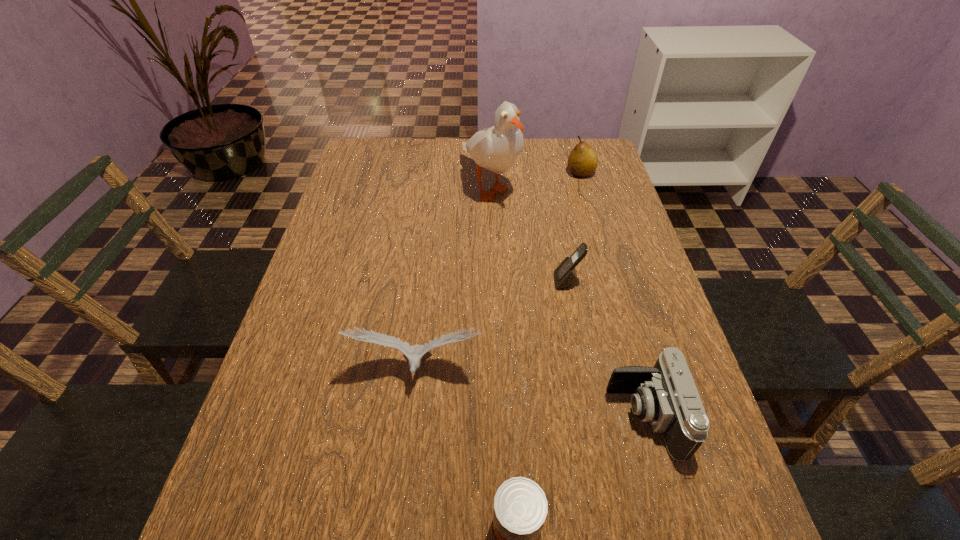
Where is `vacant space located on the front-facing side of the fourth object from left to right`? vacant space located on the front-facing side of the fourth object from left to right is located at coordinates (522, 281).

This screenshot has width=960, height=540. Find the location of `vacant space situated 0.050m on the front-facing side of the fourth object from left to right`. vacant space situated 0.050m on the front-facing side of the fourth object from left to right is located at coordinates (535, 281).

The image size is (960, 540). I want to click on vacant space located on the front-facing side of the fourth object from left to right, so click(x=535, y=281).

Where is `blank area located 0.380m at the front of the camera with an open lens cover`? This screenshot has width=960, height=540. blank area located 0.380m at the front of the camera with an open lens cover is located at coordinates (416, 416).

Where is `blank area located 0.110m at the front of the camera with an open lens cover`? The width and height of the screenshot is (960, 540). blank area located 0.110m at the front of the camera with an open lens cover is located at coordinates (554, 416).

What are the coordinates of `vacant region located at the front of the camera with an open lens cover` in the screenshot? It's located at (574, 416).

Identify the location of gull positioned at the far edge. The image size is (960, 540). (496, 148).

You are a GUI agent. You are given a task and a screenshot of the screen. Output one action in this format:
    pyautogui.click(x=<x>, y=<y>)
    Task: Click on the pear at the far edge
    
    Given the screenshot: What is the action you would take?
    pyautogui.click(x=582, y=162)

Where is `pear located in the right edge section of the desktop`? pear located in the right edge section of the desktop is located at coordinates (582, 162).

You are a GUI agent. You are given a task and a screenshot of the screen. Output one action in this format:
    pyautogui.click(x=<x>, y=<y>)
    Task: Click on the camera present at the right edge
    This screenshot has width=960, height=540.
    Given the screenshot: What is the action you would take?
    pyautogui.click(x=665, y=395)